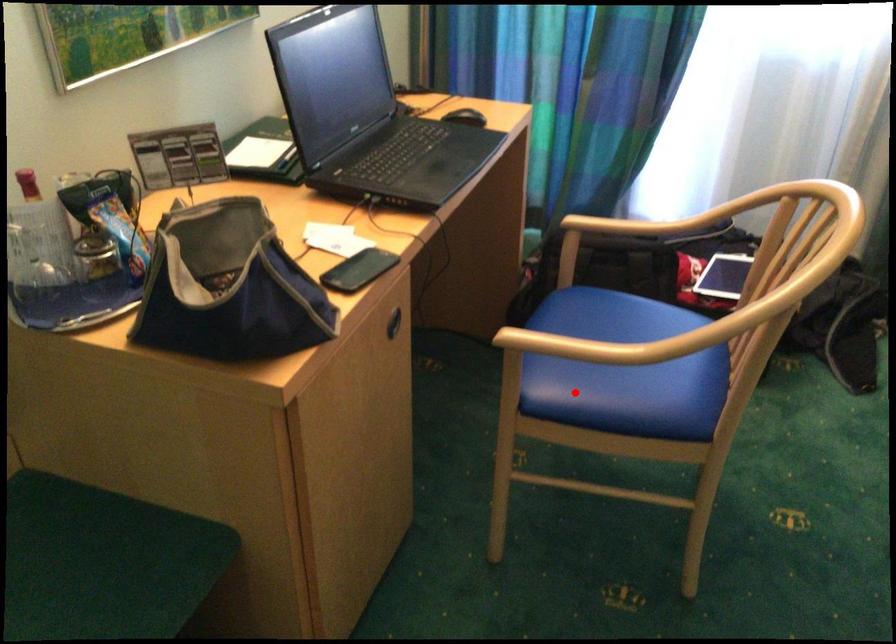
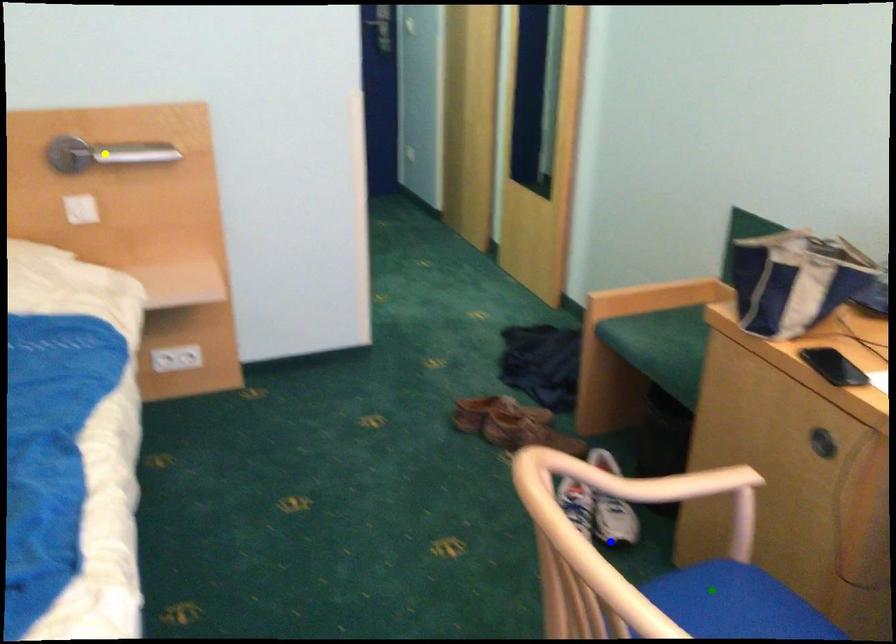
Question: I am providing you with two images of the same scene from different viewpoints. A red point is marked on the first image. You are given multiple points on the second image. In image 2, which mark is for the same physical point as the one in image 1?

Choices:
 (A) green point
 (B) blue point
 (C) yellow point

Answer: (A)